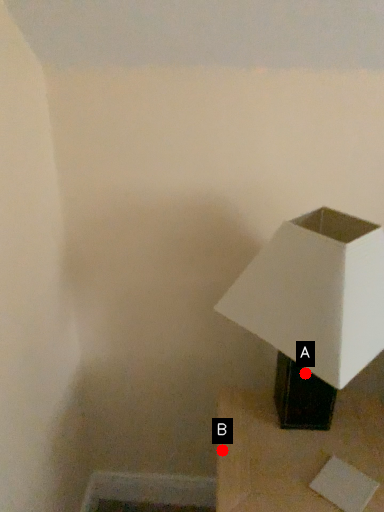
Question: Two points are circled on the image, labeled by A and B beside each circle. Which point is farther to the camera?

Choices:
 (A) A is further
 (B) B is further

Answer: (A)